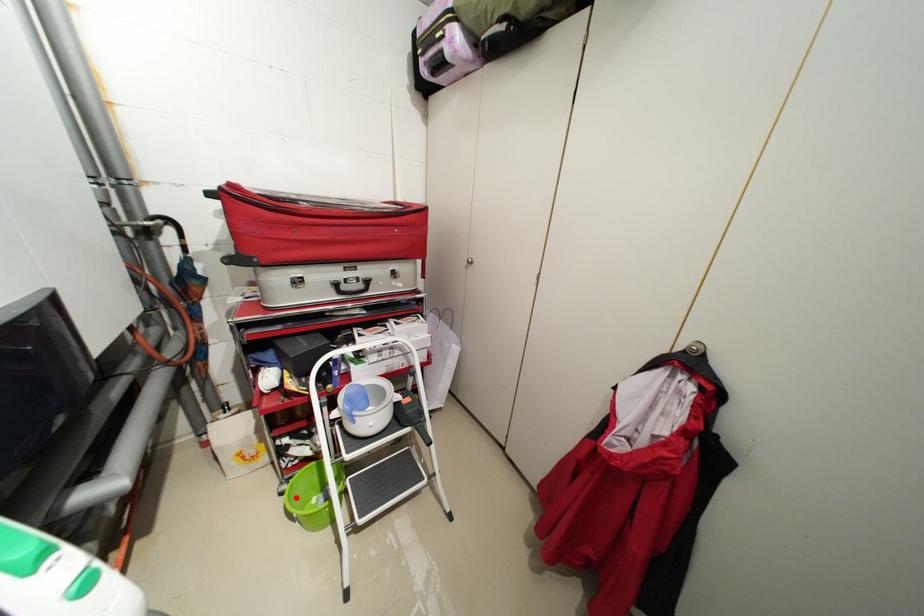
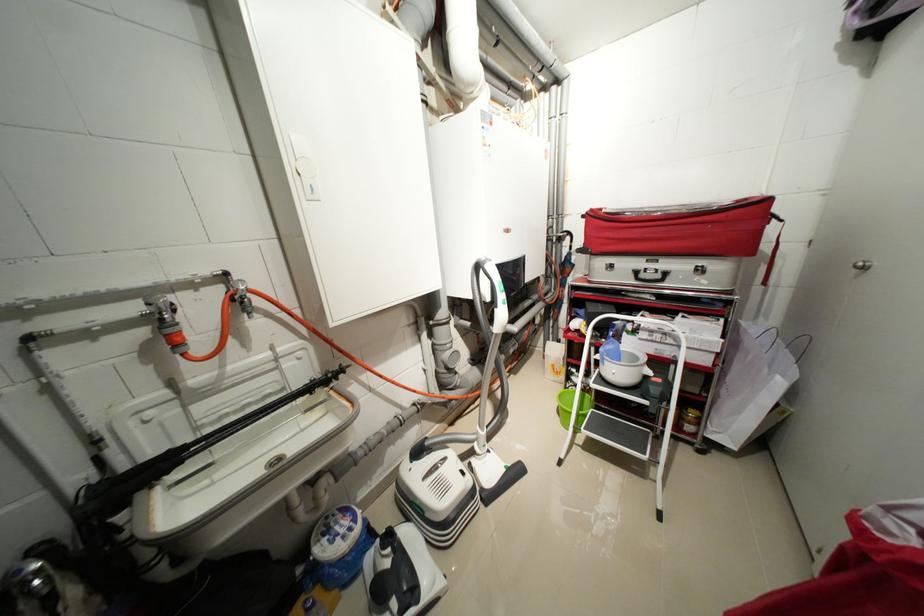
Question: I am providing you with two images of the same scene from different viewpoints. Given a red point in image1, look at the same physical point in image2. Is it:

Choices:
 (A) Closer to the viewpoint
 (B) Farther from the viewpoint

Answer: (A)